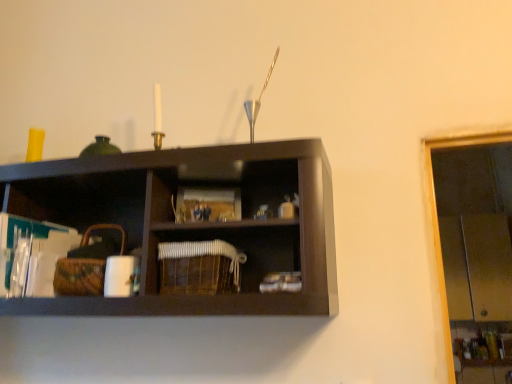
Find the location of a particular element. The width and height of the screenshot is (512, 384). woven brown basket at left, the first basket positioned from the left is located at coordinates (79, 276).

Measure the distance between woven brown basket at left, the second basket positioned from the right, and camera.

A distance of 1.11 meters exists between woven brown basket at left, the second basket positioned from the right, and camera.

This screenshot has width=512, height=384. What do you see at coordinates (79, 276) in the screenshot?
I see `woven brown basket at left, the second basket positioned from the right` at bounding box center [79, 276].

Where is `woven brown basket at center, the 2th basket in the left-to-right sequence`? The height and width of the screenshot is (384, 512). woven brown basket at center, the 2th basket in the left-to-right sequence is located at coordinates click(199, 267).

Describe the element at coordinates (199, 267) in the screenshot. I see `woven brown basket at center, the 2th basket in the left-to-right sequence` at that location.

At what (x,y) coordinates should I click in order to perform the action: click on woven brown basket at left, the second basket positioned from the right. Please return your answer as a coordinate pair (x, y). The height and width of the screenshot is (384, 512). Looking at the image, I should click on (79, 276).

In the scene shown: Between woven brown basket at left, the first basket positioned from the left, and woven brown basket at center, the 2th basket in the left-to-right sequence, which one appears on the right side from the viewer's perspective?

woven brown basket at center, the 2th basket in the left-to-right sequence, is more to the right.

Does woven brown basket at left, the first basket positioned from the left, lie behind woven brown basket at center, the 1th basket positioned from the right?

That is True.

Is point (82, 288) closer to camera compared to point (163, 291)?

No, it is behind (163, 291).

From the image's perspective, is woven brown basket at left, the second basket positioned from the right, located above or below woven brown basket at center, the 1th basket positioned from the right?

woven brown basket at left, the second basket positioned from the right, is above woven brown basket at center, the 1th basket positioned from the right.

From a real-world perspective, is woven brown basket at left, the second basket positioned from the right, located higher than woven brown basket at center, the 2th basket in the left-to-right sequence?

Correct, in the physical world, woven brown basket at left, the second basket positioned from the right, is higher than woven brown basket at center, the 2th basket in the left-to-right sequence.

Consider the image. Considering the sizes of woven brown basket at left, the second basket positioned from the right, and woven brown basket at center, the 2th basket in the left-to-right sequence, in the image, is woven brown basket at left, the second basket positioned from the right, wider or thinner than woven brown basket at center, the 2th basket in the left-to-right sequence,?

Clearly, woven brown basket at left, the second basket positioned from the right, has less width compared to woven brown basket at center, the 2th basket in the left-to-right sequence.

Between woven brown basket at left, the first basket positioned from the left, and woven brown basket at center, the 2th basket in the left-to-right sequence, which one has less height?

woven brown basket at center, the 2th basket in the left-to-right sequence, is shorter.

Considering the relative sizes of woven brown basket at left, the first basket positioned from the left, and woven brown basket at center, the 1th basket positioned from the right, in the image provided, is woven brown basket at left, the first basket positioned from the left, bigger than woven brown basket at center, the 1th basket positioned from the right,?

Yes.

Is woven brown basket at left, the second basket positioned from the right, completely or partially outside of woven brown basket at center, the 1th basket positioned from the right?

Absolutely, woven brown basket at left, the second basket positioned from the right, is external to woven brown basket at center, the 1th basket positioned from the right.

Is woven brown basket at left, the first basket positioned from the left, not near woven brown basket at center, the 1th basket positioned from the right?

They are positioned close to each other.

Does woven brown basket at left, the first basket positioned from the left, turn towards woven brown basket at center, the 1th basket positioned from the right?

No, woven brown basket at left, the first basket positioned from the left, is not oriented towards woven brown basket at center, the 1th basket positioned from the right.

How different are the orientations of woven brown basket at left, the second basket positioned from the right, and woven brown basket at center, the 2th basket in the left-to-right sequence, in degrees?

0.00129 degrees separate the facing orientations of woven brown basket at left, the second basket positioned from the right, and woven brown basket at center, the 2th basket in the left-to-right sequence.

Find the location of a particular element. The height and width of the screenshot is (384, 512). basket lying in front of the woven brown basket at left, the first basket positioned from the left is located at coordinates (199, 267).

Considering the positions of objects woven brown basket at center, the 2th basket in the left-to-right sequence, and woven brown basket at left, the second basket positioned from the right, in the image provided, who is more to the left, woven brown basket at center, the 2th basket in the left-to-right sequence, or woven brown basket at left, the second basket positioned from the right,?

woven brown basket at left, the second basket positioned from the right.

Which object is further away from the camera taking this photo, woven brown basket at center, the 2th basket in the left-to-right sequence, or woven brown basket at left, the first basket positioned from the left?

Positioned behind is woven brown basket at left, the first basket positioned from the left.

Considering the positions of points (201, 257) and (85, 268), is point (201, 257) closer to camera compared to point (85, 268)?

Yes, point (201, 257) is closer to viewer.

From the image's perspective, is woven brown basket at center, the 1th basket positioned from the right, under woven brown basket at left, the first basket positioned from the left?

Correct, woven brown basket at center, the 1th basket positioned from the right, appears lower than woven brown basket at left, the first basket positioned from the left, in the image.

From a real-world perspective, is woven brown basket at center, the 2th basket in the left-to-right sequence, positioned above or below woven brown basket at left, the second basket positioned from the right?

From a real-world perspective, woven brown basket at center, the 2th basket in the left-to-right sequence, is physically below woven brown basket at left, the second basket positioned from the right.

Between woven brown basket at center, the 2th basket in the left-to-right sequence, and woven brown basket at left, the second basket positioned from the right, which one has smaller width?

woven brown basket at left, the second basket positioned from the right, is thinner.

Consider the image. Between woven brown basket at center, the 2th basket in the left-to-right sequence, and woven brown basket at left, the first basket positioned from the left, which one has more height?

Standing taller between the two is woven brown basket at left, the first basket positioned from the left.

Looking at the image, does woven brown basket at center, the 2th basket in the left-to-right sequence, seem bigger or smaller compared to woven brown basket at left, the first basket positioned from the left?

In the image, woven brown basket at center, the 2th basket in the left-to-right sequence, appears to be smaller than woven brown basket at left, the first basket positioned from the left.

Is woven brown basket at center, the 1th basket positioned from the right, positioned beyond the bounds of woven brown basket at left, the second basket positioned from the right?

Yes, woven brown basket at center, the 1th basket positioned from the right, is not within woven brown basket at left, the second basket positioned from the right.

Can you see woven brown basket at center, the 2th basket in the left-to-right sequence, touching woven brown basket at left, the second basket positioned from the right?

There is a gap between woven brown basket at center, the 2th basket in the left-to-right sequence, and woven brown basket at left, the second basket positioned from the right.

Is woven brown basket at left, the second basket positioned from the right, at the back of woven brown basket at center, the 2th basket in the left-to-right sequence?

That's not correct — woven brown basket at center, the 2th basket in the left-to-right sequence, is not looking away from woven brown basket at left, the second basket positioned from the right.

Could you measure the distance between woven brown basket at center, the 1th basket positioned from the right, and woven brown basket at left, the first basket positioned from the left?

woven brown basket at center, the 1th basket positioned from the right, is 25.92 centimeters from woven brown basket at left, the first basket positioned from the left.

At what (x,y) coordinates should I click in order to perform the action: click on basket below the woven brown basket at left, the second basket positioned from the right (from the image's perspective). Please return your answer as a coordinate pair (x, y). Looking at the image, I should click on (199, 267).

The width and height of the screenshot is (512, 384). Find the location of `basket located on the left of woven brown basket at center, the 1th basket positioned from the right`. basket located on the left of woven brown basket at center, the 1th basket positioned from the right is located at coordinates (79, 276).

I want to click on basket below the woven brown basket at left, the first basket positioned from the left (from the image's perspective), so click(199, 267).